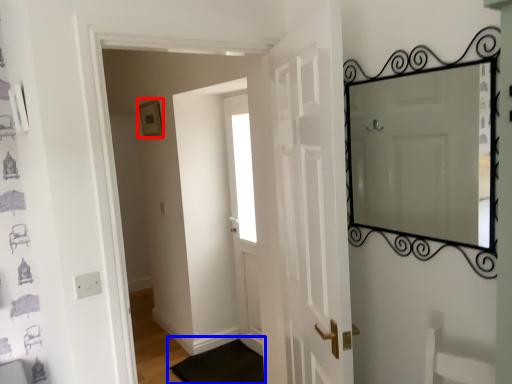
Question: Among these objects, which one is nearest to the camera, picture frame (highlighted by a red box) or doormat (highlighted by a blue box)?

Choices:
 (A) picture frame
 (B) doormat

Answer: (B)